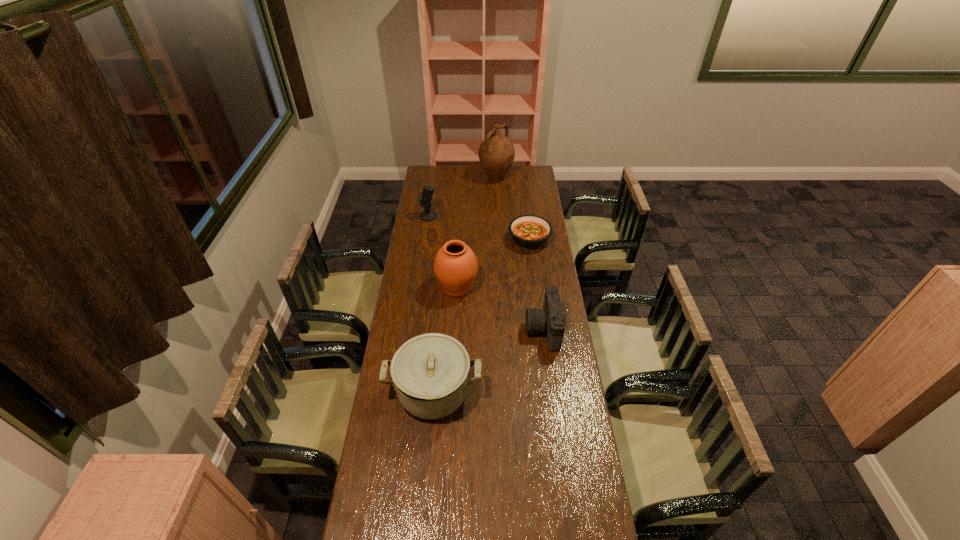
Locate an element on the screen. This screenshot has width=960, height=540. free space between the third nearest object and the camera is located at coordinates (500, 308).

Where is `empty space between the farthest object and the stew`? The image size is (960, 540). empty space between the farthest object and the stew is located at coordinates (513, 209).

The width and height of the screenshot is (960, 540). I want to click on free spot between the fourth farthest object and the stew, so click(x=493, y=263).

You are a GUI agent. You are given a task and a screenshot of the screen. Output one action in this format:
    pyautogui.click(x=<x>, y=<y>)
    Task: Click on the free space between the tallest object and the microphone
    The height and width of the screenshot is (540, 960).
    Given the screenshot: What is the action you would take?
    pyautogui.click(x=463, y=197)

Select which object is the fourth closest to the urn. Please provide its 2D coordinates. Your answer should be formatted as a tuple, i.e. [(x, y)], where the tuple contains the x and y coordinates of a point satisfying the conditions above.

[(428, 215)]

Locate an element on the screen. object that is the fifth closest one to the fifth shortest object is located at coordinates (x=496, y=153).

Find the location of `vacant area in the image that satisfies the following two spatial constraints: 1. on the back side of the shortest object; 2. on the left side of the fourth farthest object`. vacant area in the image that satisfies the following two spatial constraints: 1. on the back side of the shortest object; 2. on the left side of the fourth farthest object is located at coordinates (459, 240).

Where is `vacant region that satisfies the following two spatial constraints: 1. on the front side of the microphone; 2. on the right side of the fourth farthest object`? vacant region that satisfies the following two spatial constraints: 1. on the front side of the microphone; 2. on the right side of the fourth farthest object is located at coordinates (419, 286).

Locate an element on the screen. This screenshot has height=540, width=960. vacant space that satisfies the following two spatial constraints: 1. on the back side of the saucepan; 2. on the right side of the urn is located at coordinates (443, 286).